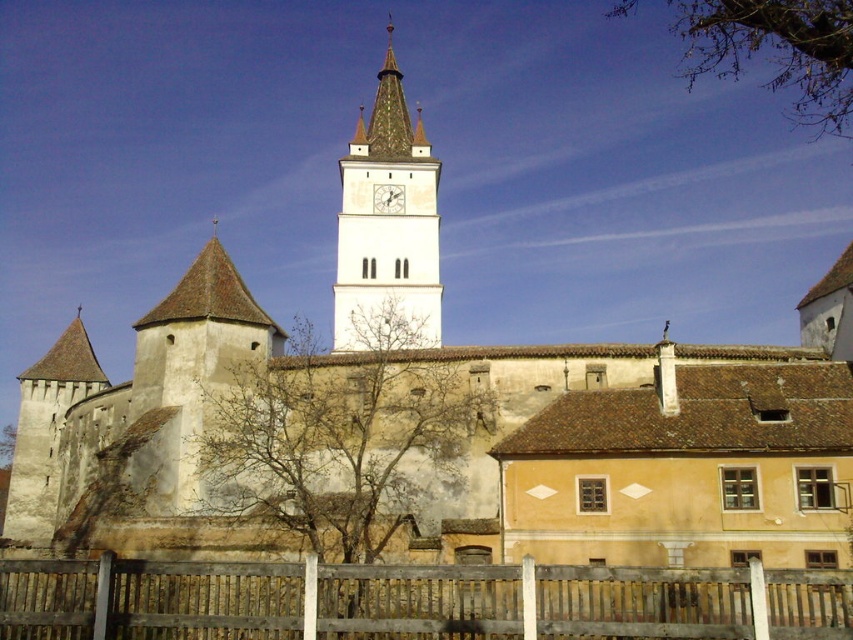
Which is behind, point (280, 486) or point (677, 17)?

The point (677, 17) is behind.

Based on the photo, can you confirm if bare branches at center is thinner than brown leafy tree at upper right?

Correct, bare branches at center's width is less than brown leafy tree at upper right's.

Is point (404, 388) positioned after point (846, 16)?

Yes, it is behind point (846, 16).

This screenshot has height=640, width=853. Find the location of `bare branches at center`. bare branches at center is located at coordinates (339, 436).

Is bare branches at center to the right of white stone clock tower at center from the viewer's perspective?

No, bare branches at center is not to the right of white stone clock tower at center.

Is bare branches at center behind white stone clock tower at center?

That is False.

Find the location of a particular element. The image size is (853, 640). bare branches at center is located at coordinates (339, 436).

Can you confirm if brown wooden fence at lower center is positioned to the right of white stone clock tower at center?

Yes, brown wooden fence at lower center is to the right of white stone clock tower at center.

Who is more distant from viewer, (91, 588) or (340, 268)?

Point (340, 268)

Locate an element on the screen. brown wooden fence at lower center is located at coordinates (415, 602).